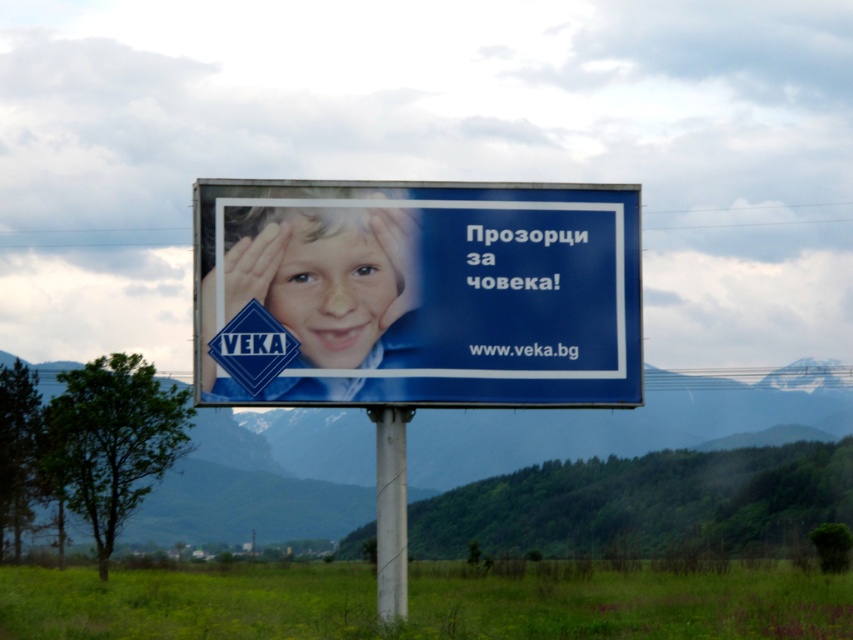
Does point (270, 294) come farther from viewer compared to point (399, 440)?

No, (270, 294) is in front of (399, 440).

Consider the image. Does matte blue face at center have a greater height compared to white plastic pole at center?

In fact, matte blue face at center may be shorter than white plastic pole at center.

Where is `matte blue face at center`? matte blue face at center is located at coordinates (334, 291).

Which is more to the right, blue glossy billboard at center or white plastic pole at center?

Positioned to the right is blue glossy billboard at center.

Which is behind, point (267, 193) or point (384, 561)?

The point (384, 561) is more distant.

Which is behind, point (451, 307) or point (405, 518)?

The point (405, 518) is behind.

Identify the location of blue glossy billboard at center. (426, 291).

Is blue glossy billboard at center further to the viewer compared to matte blue face at center?

Yes, it is.

Who is lower down, blue glossy billboard at center or matte blue face at center?

Positioned lower is blue glossy billboard at center.

In order to click on blue glossy billboard at center in this screenshot , I will do `click(426, 291)`.